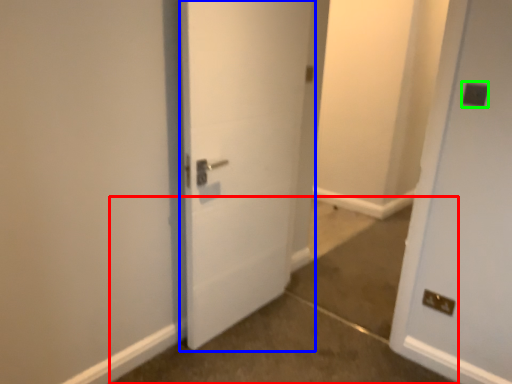
Question: Which object is positioned closest to concrete (highlighted by a red box)? Select from door (highlighted by a blue box) and electric outlet (highlighted by a green box).

Choices:
 (A) door
 (B) electric outlet

Answer: (A)